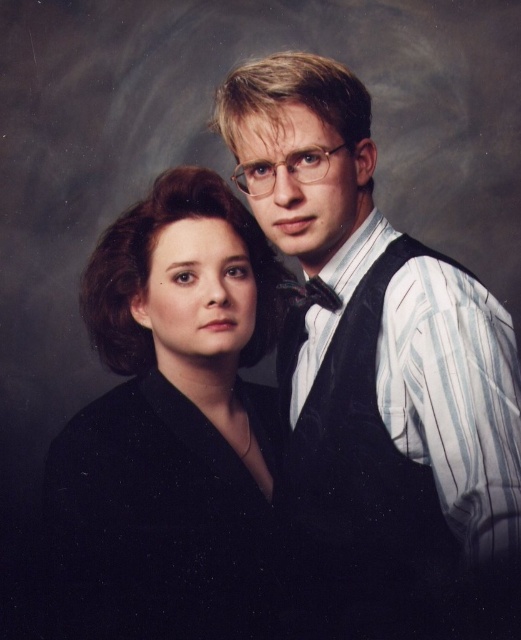
Does matte black vest at right have a lesser height compared to shiny black bow tie at center?

No.

Does point (355, 413) come closer to viewer compared to point (305, 292)?

Yes, point (355, 413) is closer to viewer.

Find the location of a particular element. The height and width of the screenshot is (640, 521). matte black vest at right is located at coordinates (379, 378).

Identify the location of matte black vest at right. (379, 378).

Is matte black vest at right bigger than black fabric at center?

Indeed, matte black vest at right has a larger size compared to black fabric at center.

From the picture: Which is more to the left, matte black vest at right or black fabric at center?

Positioned to the left is black fabric at center.

What do you see at coordinates (379, 378) in the screenshot?
I see `matte black vest at right` at bounding box center [379, 378].

Identify the location of matte black vest at right. (379, 378).

Can you confirm if black fabric at center is taller than shiny black bow tie at center?

Yes.

Between black fabric at center and shiny black bow tie at center, which one is positioned lower?

Positioned lower is black fabric at center.

Between point (164, 285) and point (279, 294), which one is positioned in front?

Point (164, 285) is more forward.

Locate an element on the screen. The width and height of the screenshot is (521, 640). black fabric at center is located at coordinates (170, 428).